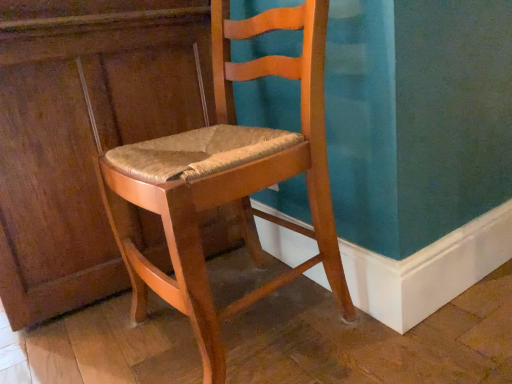
Question: From the image's perspective, is matte wood chair at center under matte wood dresser at left?

Choices:
 (A) no
 (B) yes

Answer: (B)

Question: Does matte wood chair at center have a greater height compared to matte wood dresser at left?

Choices:
 (A) yes
 (B) no

Answer: (B)

Question: Is matte wood chair at center oriented towards matte wood dresser at left?

Choices:
 (A) no
 (B) yes

Answer: (A)

Question: Is matte wood chair at center wider than matte wood dresser at left?

Choices:
 (A) no
 (B) yes

Answer: (A)

Question: From a real-world perspective, is matte wood chair at center located higher than matte wood dresser at left?

Choices:
 (A) no
 (B) yes

Answer: (A)

Question: Is matte wood dresser at left surrounded by matte wood chair at center?

Choices:
 (A) no
 (B) yes

Answer: (A)

Question: Does matte wood dresser at left touch matte wood chair at center?

Choices:
 (A) yes
 (B) no

Answer: (B)

Question: Is matte wood dresser at left far from matte wood chair at center?

Choices:
 (A) no
 (B) yes

Answer: (A)

Question: Is matte wood dresser at left positioned with its back to matte wood chair at center?

Choices:
 (A) no
 (B) yes

Answer: (A)

Question: Is matte wood dresser at left shorter than matte wood chair at center?

Choices:
 (A) no
 (B) yes

Answer: (A)

Question: Is matte wood dresser at left wider than matte wood chair at center?

Choices:
 (A) no
 (B) yes

Answer: (B)

Question: From the image's perspective, is matte wood dresser at left over matte wood chair at center?

Choices:
 (A) yes
 (B) no

Answer: (A)

Question: From a real-world perspective, is matte wood chair at center above or below matte wood dresser at left?

Choices:
 (A) above
 (B) below

Answer: (B)